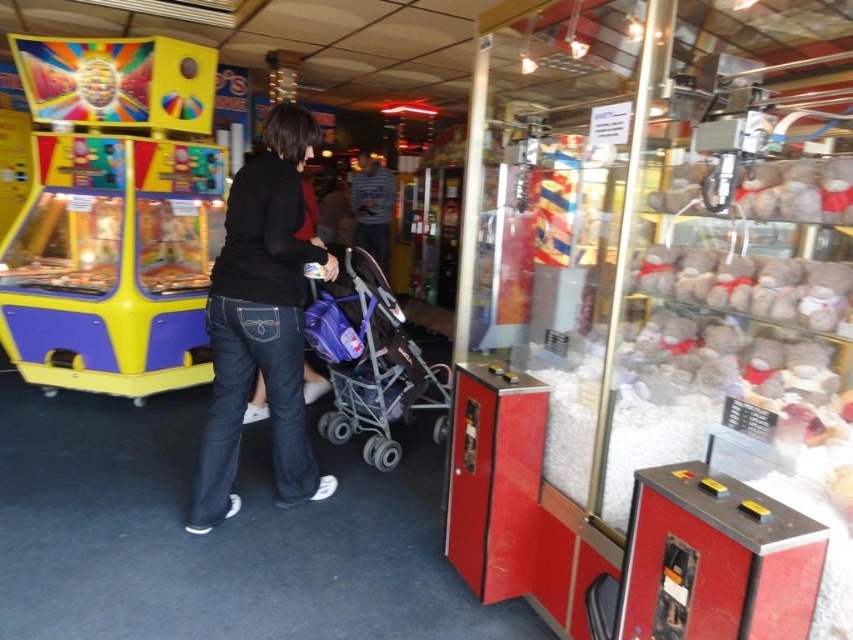
You are a parent with a child in the arcade. You see the shiny plastic claw machine at left and the striped shirt at center. Which object is closer to the entrance of the arcade?

The shiny plastic claw machine at left is closer to the entrance of the arcade because it is positioned to the left of the striped shirt at center, and in many arcades, the entrance is typically on the left side.

You are standing in the arcade and need to reach the claw machine on the left. There is a person wearing black denim jeans at center in your way. Can you walk around them to get to the claw machine?

Yes, you can walk around the person wearing black denim jeans at center since they are positioned centrally, allowing space to navigate to the claw machine on the left.

You are a parent in the arcade with your child in the stroller. You see the shiny plastic claw machine at left and the striped shirt at center. Which object is closer to the floor?

The shiny plastic claw machine at left is closer to the floor because it is positioned below the striped shirt at center.